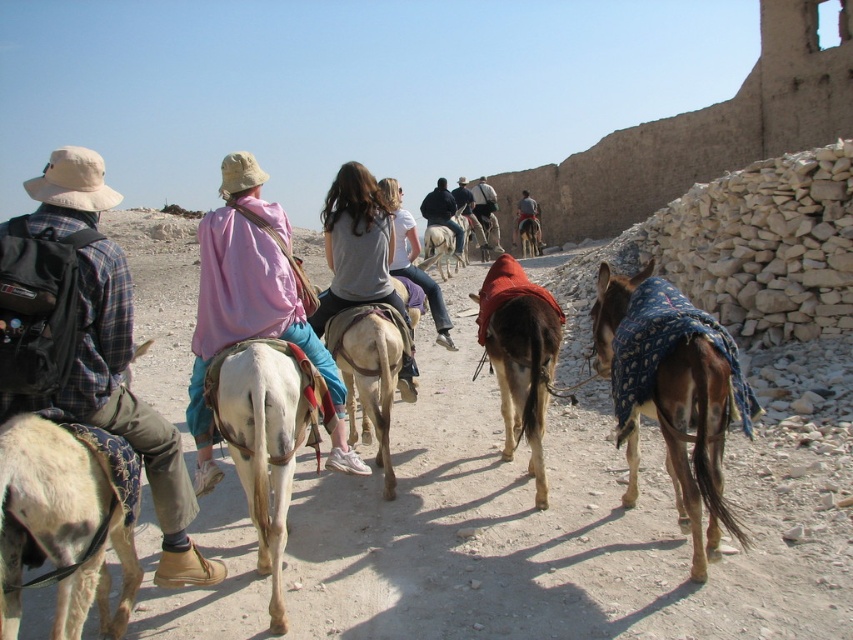
Does red clothed donkey at center come behind light brown leather jacket at center?

No, red clothed donkey at center is closer to the viewer.

Who is positioned more to the left, red clothed donkey at center or light brown leather jacket at center?

From the viewer's perspective, light brown leather jacket at center appears more on the left side.

This screenshot has height=640, width=853. Find the location of `red clothed donkey at center`. red clothed donkey at center is located at coordinates (519, 355).

Does gray cotton shirt at center have a larger size compared to light brown fabric-covered donkey at center?

Indeed, gray cotton shirt at center has a larger size compared to light brown fabric-covered donkey at center.

Is point (347, 189) closer to viewer compared to point (448, 236)?

Yes, point (347, 189) is closer to viewer.

Locate an element on the screen. The image size is (853, 640). gray cotton shirt at center is located at coordinates (357, 244).

Is pink fabric jacket at center to the right of light gray cotton shirt at center from the viewer's perspective?

Incorrect, pink fabric jacket at center is not on the right side of light gray cotton shirt at center.

Between pink fabric jacket at center and light gray cotton shirt at center, which one appears on the left side from the viewer's perspective?

From the viewer's perspective, pink fabric jacket at center appears more on the left side.

Does point (263, 332) come farther from viewer compared to point (384, 184)?

No, it is not.

Locate an element on the screen. pink fabric jacket at center is located at coordinates (253, 305).